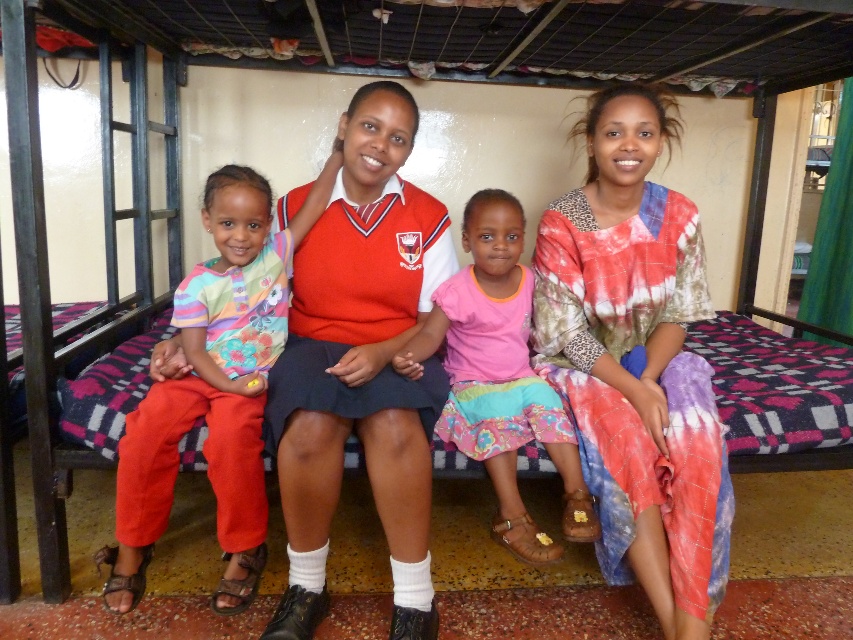
Question: Does multicolored tie-dye dress at center have a lesser width compared to matte floral shirt at left?

Choices:
 (A) no
 (B) yes

Answer: (B)

Question: Which point is farther to the camera?

Choices:
 (A) pink fabric skirt at center
 (B) multicolored tie-dye dress at center
 (C) matte floral shirt at left

Answer: (A)

Question: Which point is farther to the camera?

Choices:
 (A) (155, 512)
 (B) (515, 529)

Answer: (B)

Question: Is multicolored tie-dye dress at center above matte floral shirt at left?

Choices:
 (A) yes
 (B) no

Answer: (A)

Question: In this image, where is multicolored tie-dye dress at center located relative to pink fabric skirt at center?

Choices:
 (A) right
 (B) left

Answer: (A)

Question: Which of these objects is positioned farthest from the pink fabric skirt at center?

Choices:
 (A) multicolored tie-dye dress at center
 (B) matte floral shirt at left

Answer: (B)